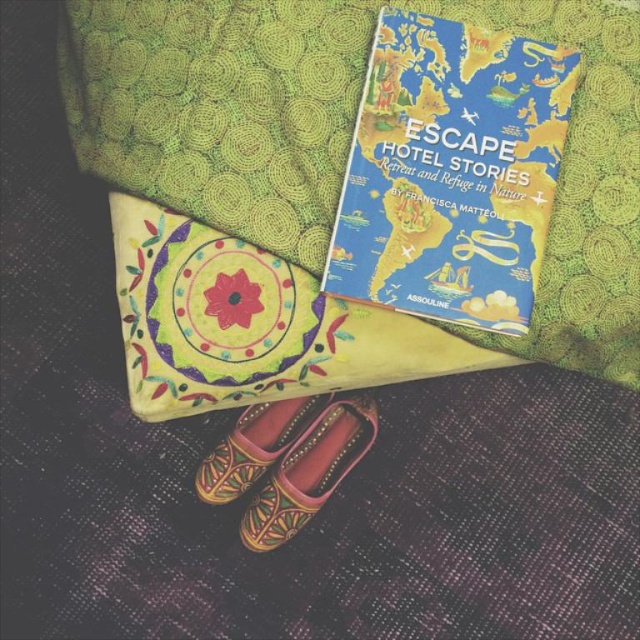
You are a delivery person who needs to place a small package between the green textured blanket at upper center and the leather textured shoe at lower center. Can you fit the package if it measures 15 inches in length?

The distance between the green textured blanket at upper center and the leather textured shoe at lower center is 14.74 inches. Since the package is 15 inches long, it won

You are organizing a bookshelf and need to place the blue matte book at upper center and the leather textured shoe at lower center. Since the shelf has limited vertical space, which item should you place first to ensure both fit vertically?

The blue matte book at upper center is taller than the leather textured shoe at lower center. To ensure both items fit vertically on the shelf with limited space, you should place the taller item, the blue matte book at upper center, first and position the shorter leather textured shoe at lower center beneath it.